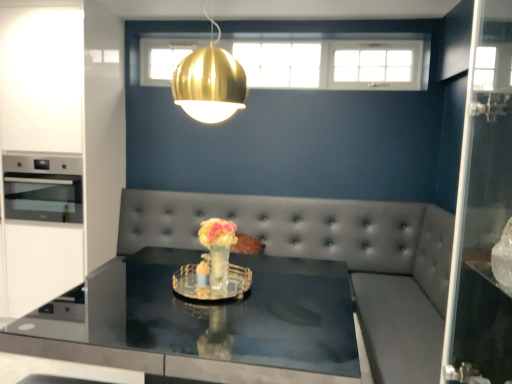
You are a GUI agent. You are given a task and a screenshot of the screen. Output one action in this format:
    pyautogui.click(x=<x>, y=<y>)
    Task: Click on the translucent glass vase at center
    
    Given the screenshot: What is the action you would take?
    pyautogui.click(x=214, y=266)

Where is `shiny black glass table at center`? The width and height of the screenshot is (512, 384). shiny black glass table at center is located at coordinates (208, 323).

Measure the distance between point (x=187, y=110) and camera.

The depth of point (x=187, y=110) is 6.43 feet.

This screenshot has height=384, width=512. I want to click on translucent glass vase at center, so click(214, 266).

Is shiny black glass table at center shorter than gold metallic pendant light at upper center?

No, shiny black glass table at center is not shorter than gold metallic pendant light at upper center.

Is gold metallic pendant light at upper center completely or partially inside shiny black glass table at center?

That's incorrect, gold metallic pendant light at upper center is not inside shiny black glass table at center.

This screenshot has height=384, width=512. In the image, there is a shiny black glass table at center. Find the location of `light above it (from the image's perspective)`. light above it (from the image's perspective) is located at coordinates (210, 82).

From the picture: Could you measure the distance between shiny black glass table at center and gold metallic pendant light at upper center?

shiny black glass table at center is 38.53 inches away from gold metallic pendant light at upper center.

Looking at this image, does translucent glass vase at center have a lesser height compared to white glossy cabinetry at left?

Indeed, translucent glass vase at center has a lesser height compared to white glossy cabinetry at left.

Considering the sizes of objects translucent glass vase at center and white glossy cabinetry at left in the image provided, who is smaller, translucent glass vase at center or white glossy cabinetry at left?

translucent glass vase at center is smaller.

Is translucent glass vase at center further to camera compared to white glossy cabinetry at left?

No.

Is translucent glass vase at center next to white glossy cabinetry at left and touching it?

translucent glass vase at center and white glossy cabinetry at left are clearly separated.

Is translucent glass vase at center to the left or to the right of stainless steel oven at left in the image?

Based on their positions, translucent glass vase at center is located to the right of stainless steel oven at left.

Is point (217, 293) positioned before point (33, 169)?

Yes, point (217, 293) is closer to viewer.

From a real-world perspective, which object stands above the other?

In real-world perspective, stainless steel oven at left is above.

Can you confirm if translucent glass vase at center is thinner than stainless steel oven at left?

Yes.

Consider the image. Does white glossy cabinetry at left turn towards shiny black glass table at center?

No, white glossy cabinetry at left is not oriented towards shiny black glass table at center.

Who is smaller, white glossy cabinetry at left or shiny black glass table at center?

Smaller between the two is white glossy cabinetry at left.

Which object is further away from the camera, white glossy cabinetry at left or shiny black glass table at center?

white glossy cabinetry at left is further from the camera.

Can you confirm if white glossy cabinetry at left is thinner than shiny black glass table at center?

Yes.

The height and width of the screenshot is (384, 512). Identify the location of floral arrangement to the right of white glossy cabinetry at left. (214, 266).

From the image's perspective, which is above, white glossy cabinetry at left or translucent glass vase at center?

white glossy cabinetry at left appears higher in the image.

How different are the orientations of white glossy cabinetry at left and translucent glass vase at center in degrees?

white glossy cabinetry at left and translucent glass vase at center are facing 8.29 degrees away from each other.

Choose the correct answer: Is gold metallic pendant light at upper center inside translucent glass vase at center or outside it?

The correct answer is: outside.

From the image's perspective, between gold metallic pendant light at upper center and translucent glass vase at center, who is located below?

From the image's view, translucent glass vase at center is below.

Which of these two, gold metallic pendant light at upper center or translucent glass vase at center, stands taller?

gold metallic pendant light at upper center.

Based on the photo, between gold metallic pendant light at upper center and translucent glass vase at center, which one has smaller width?

translucent glass vase at center is thinner.

Is white glossy cabinetry at left at the left side of stainless steel oven at left?

In fact, white glossy cabinetry at left is to the right of stainless steel oven at left.

Between white glossy cabinetry at left and stainless steel oven at left, which one has less height?

With less height is stainless steel oven at left.

Is white glossy cabinetry at left wider than stainless steel oven at left?

No, white glossy cabinetry at left is not wider than stainless steel oven at left.

Identify the location of table below the gold metallic pendant light at upper center (from the image's perspective). The height and width of the screenshot is (384, 512). (208, 323).

You are a GUI agent. You are given a task and a screenshot of the screen. Output one action in this format:
    pyautogui.click(x=<x>, y=<y>)
    Task: Click on the cabinetry above the translucent glass vase at center (from a real-world perspective)
    Image resolution: width=512 pixels, height=384 pixels.
    Given the screenshot: What is the action you would take?
    pyautogui.click(x=62, y=141)

From the image, which object appears to be farther from gold metallic pendant light at upper center, stainless steel oven at left or shiny black glass table at center?

The object further to gold metallic pendant light at upper center is stainless steel oven at left.

From the picture: When comparing their distances from white glossy cabinetry at left, does gold metallic pendant light at upper center or stainless steel oven at left seem closer?

stainless steel oven at left is positioned closer to the anchor white glossy cabinetry at left.

Looking at the image, which one is located closer to gold metallic pendant light at upper center, translucent glass vase at center or shiny black glass table at center?

The object closer to gold metallic pendant light at upper center is translucent glass vase at center.

Consider the image. Estimate the real-world distances between objects in this image. Which object is further from translucent glass vase at center, white glossy cabinetry at left or gold metallic pendant light at upper center?

white glossy cabinetry at left is positioned further to the anchor translucent glass vase at center.

Based on their spatial positions, is stainless steel oven at left or shiny black glass table at center further from white glossy cabinetry at left?

shiny black glass table at center.

Considering their positions, is translucent glass vase at center positioned further to white glossy cabinetry at left than stainless steel oven at left?

translucent glass vase at center is further to white glossy cabinetry at left.

Consider the image. Estimate the real-world distances between objects in this image. Which object is further from translucent glass vase at center, stainless steel oven at left or white glossy cabinetry at left?

Based on the image, white glossy cabinetry at left appears to be further to translucent glass vase at center.

Estimate the real-world distances between objects in this image. Which object is further from stainless steel oven at left, white glossy cabinetry at left or shiny black glass table at center?

Based on the image, shiny black glass table at center appears to be further to stainless steel oven at left.

I want to click on floral arrangement located between shiny black glass table at center and stainless steel oven at left in the depth direction, so click(x=214, y=266).

The height and width of the screenshot is (384, 512). Identify the location of cabinetry between gold metallic pendant light at upper center and shiny black glass table at center in the vertical direction. (62, 141).

Locate an element on the screen. cabinetry between shiny black glass table at center and stainless steel oven at left along the z-axis is located at coordinates (62, 141).

Find the location of `cabinetry between stainless steel oven at left and gold metallic pendant light at upper center in the horizontal direction`. cabinetry between stainless steel oven at left and gold metallic pendant light at upper center in the horizontal direction is located at coordinates (62, 141).